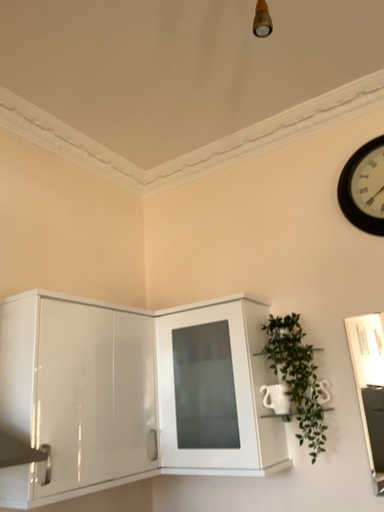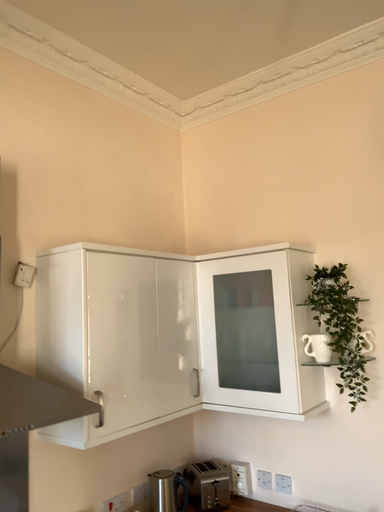
Question: How did the camera likely rotate when shooting the video?

Choices:
 (A) rotated upward
 (B) rotated downward

Answer: (B)